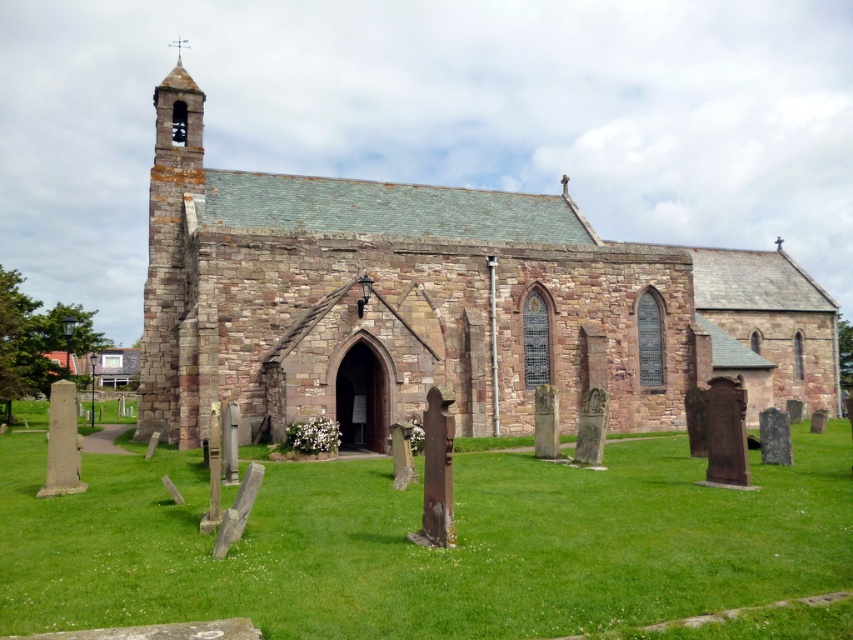
Question: Considering the relative positions of brown stone church at center and green grass at center in the image provided, where is brown stone church at center located with respect to green grass at center?

Choices:
 (A) above
 (B) below

Answer: (A)

Question: In this image, where is brown stone church at center located relative to green grass at center?

Choices:
 (A) above
 (B) below

Answer: (A)

Question: Among these points, which one is farthest from the camera?

Choices:
 (A) (328, 262)
 (B) (86, 577)

Answer: (A)

Question: Is brown stone church at center above green grass at center?

Choices:
 (A) yes
 (B) no

Answer: (A)

Question: Among these points, which one is nearest to the camera?

Choices:
 (A) (38, 499)
 (B) (248, 428)

Answer: (A)